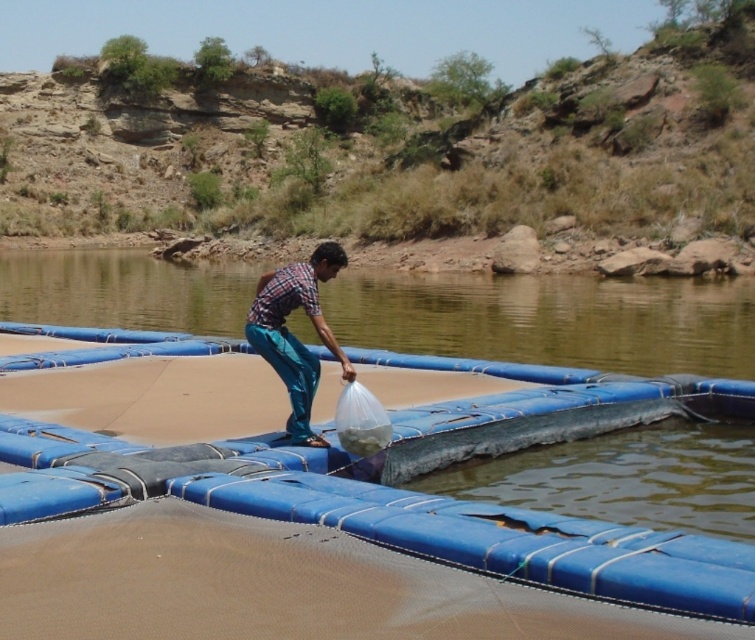
Question: Where is blue rubber raft at center located in relation to plaid shirt at center in the image?

Choices:
 (A) above
 (B) below

Answer: (A)

Question: Which point is farther to the camera?

Choices:
 (A) (287, 275)
 (B) (741, 280)

Answer: (B)

Question: Which of the following is the closest to the observer?

Choices:
 (A) blue rubber raft at center
 (B) plaid shirt at center

Answer: (B)

Question: Can you confirm if blue rubber raft at center is positioned above plaid shirt at center?

Choices:
 (A) no
 (B) yes

Answer: (B)

Question: Which point is closer to the camera?

Choices:
 (A) blue rubber raft at center
 (B) plaid shirt at center

Answer: (B)

Question: Does blue rubber raft at center appear over plaid shirt at center?

Choices:
 (A) no
 (B) yes

Answer: (B)